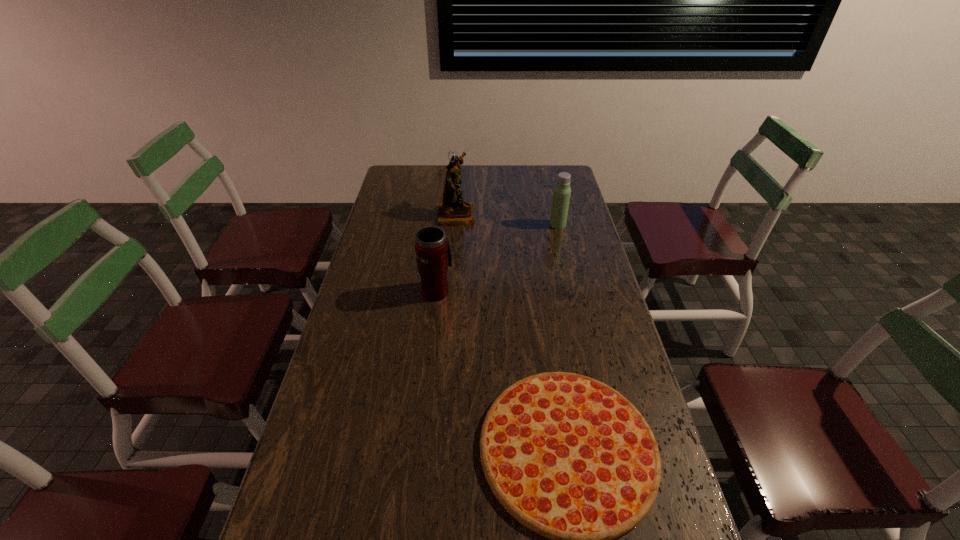
You are a GUI agent. You are given a task and a screenshot of the screen. Output one action in this format:
    pyautogui.click(x=<x>, y=<y>)
    Task: Click on the figurine
    The width and height of the screenshot is (960, 540).
    Given the screenshot: What is the action you would take?
    pyautogui.click(x=454, y=211)

At what (x,y) coordinates should I click in order to perform the action: click on the third farthest object. Please return your answer as a coordinate pair (x, y). The width and height of the screenshot is (960, 540). Looking at the image, I should click on (433, 251).

At what (x,y) coordinates should I click in order to perform the action: click on the nearer thermos bottle. Please return your answer as a coordinate pair (x, y). This screenshot has width=960, height=540. Looking at the image, I should click on (433, 251).

I want to click on the farther thermos bottle, so click(561, 195).

The height and width of the screenshot is (540, 960). In order to click on free spot located on the front-facing side of the tallest object in this screenshot , I will do `click(556, 214)`.

In order to click on free spot located on the side with the handle of the third farthest object in this screenshot , I will do `click(443, 241)`.

Locate an element on the screen. The width and height of the screenshot is (960, 540). vacant region located 0.240m on the side with the handle of the third farthest object is located at coordinates (443, 239).

Where is `free space located 0.220m on the side with the handle of the third farthest object`? This screenshot has height=540, width=960. free space located 0.220m on the side with the handle of the third farthest object is located at coordinates (442, 242).

Find the location of `vacant region located on the back of the right thermos bottle`. vacant region located on the back of the right thermos bottle is located at coordinates click(x=548, y=185).

Where is `object present at the right edge`? This screenshot has height=540, width=960. object present at the right edge is located at coordinates (561, 195).